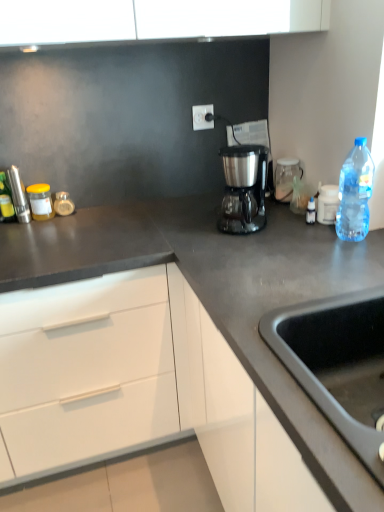
Where is `vacant area that lies to the right of matte yellow jar at left`? The height and width of the screenshot is (512, 384). vacant area that lies to the right of matte yellow jar at left is located at coordinates (85, 216).